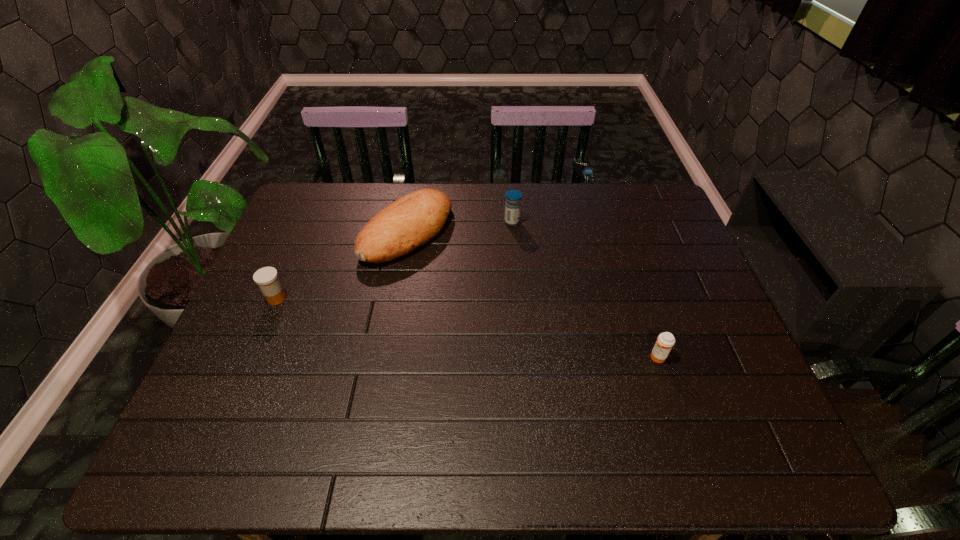
Locate an element on the screen. The height and width of the screenshot is (540, 960). the farthest medicine is located at coordinates (513, 198).

You are a GUI agent. You are given a task and a screenshot of the screen. Output one action in this format:
    pyautogui.click(x=<x>, y=<y>)
    Task: Click on the second medicine from right to left
    This screenshot has height=540, width=960.
    Given the screenshot: What is the action you would take?
    point(513,198)

Find the location of a particular element. This screenshot has height=540, width=960. bread is located at coordinates (409, 222).

Locate an element on the screen. Image resolution: width=960 pixels, height=540 pixels. the third farthest object is located at coordinates (267, 277).

At what (x,y) coordinates should I click in order to perform the action: click on the leftmost object. Please return your answer as a coordinate pair (x, y). Looking at the image, I should click on (267, 277).

Find the location of `the rightmost medicine`. the rightmost medicine is located at coordinates (665, 341).

You are a GUI agent. You are given a task and a screenshot of the screen. Output one action in this format:
    pyautogui.click(x=<x>, y=<y>)
    Task: Click on the nearest medicine
    
    Given the screenshot: What is the action you would take?
    pyautogui.click(x=665, y=341)

This screenshot has width=960, height=540. Identify the location of free region located on the right of the farthest medicine. (640, 222).

The image size is (960, 540). In order to click on vacant space located 0.380m on the front of the bread in this screenshot , I will do `click(380, 390)`.

The height and width of the screenshot is (540, 960). Find the location of `free region located on the label of the third farthest object`. free region located on the label of the third farthest object is located at coordinates (438, 299).